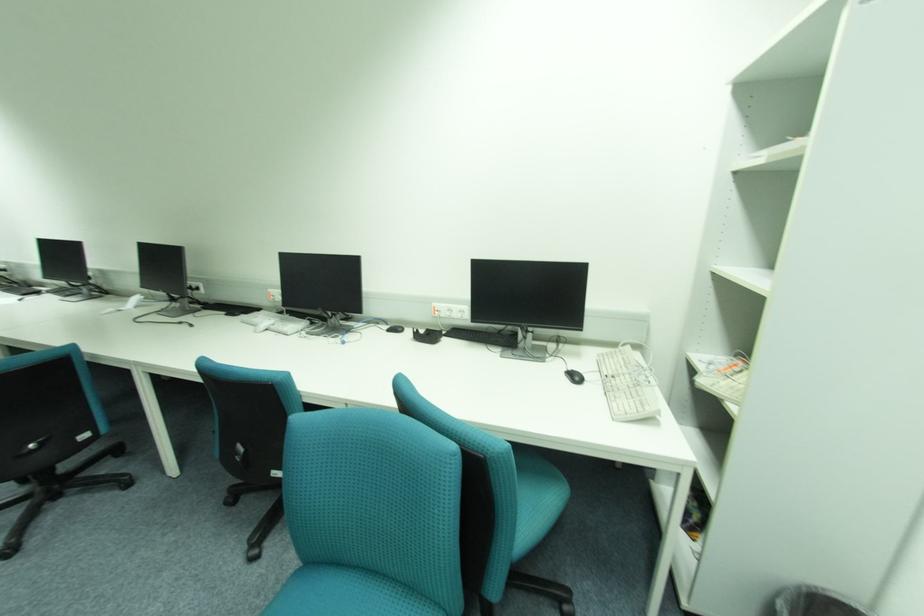
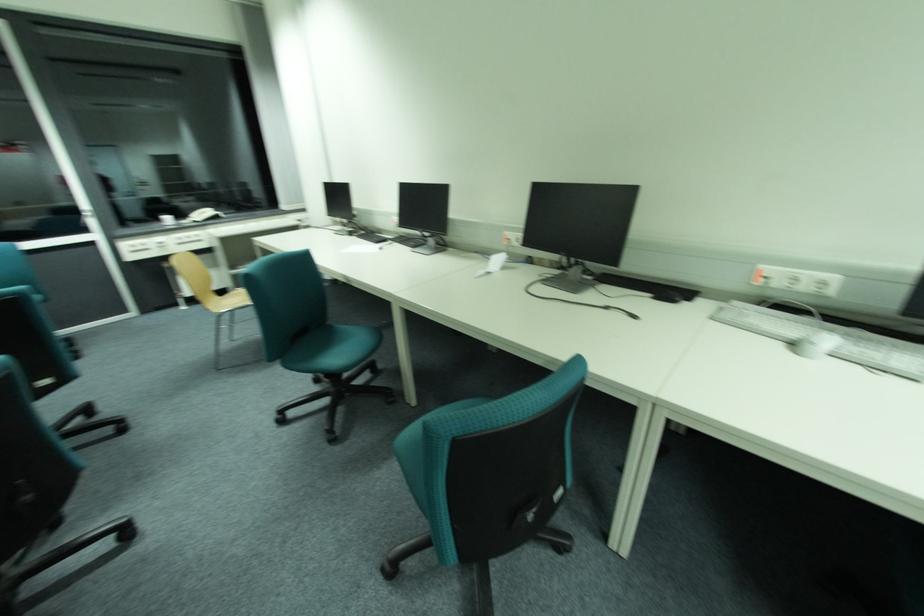
In the second image, find the point that corresponds to point (280, 300) in the first image.

(772, 283)